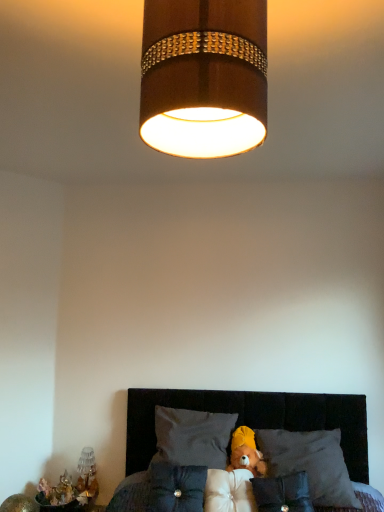
Question: Which direction should I rotate to look at dark gray fabric pillow at center, the fifth pillow positioned from the left?

Choices:
 (A) left
 (B) right

Answer: (B)

Question: Is gray fabric pillow at center, the second pillow in the left-to-right sequence, thinner than wooden lampshade at upper center?

Choices:
 (A) yes
 (B) no

Answer: (B)

Question: Is gray fabric pillow at center, the fourth pillow positioned from the right, taller than wooden lampshade at upper center?

Choices:
 (A) no
 (B) yes

Answer: (A)

Question: Does gray fabric pillow at center, the second pillow in the left-to-right sequence, lie in front of wooden lampshade at upper center?

Choices:
 (A) no
 (B) yes

Answer: (A)

Question: Is gray fabric pillow at center, the second pillow in the left-to-right sequence, at the left side of wooden lampshade at upper center?

Choices:
 (A) yes
 (B) no

Answer: (A)

Question: Considering the relative sizes of gray fabric pillow at center, the fourth pillow positioned from the right, and wooden lampshade at upper center in the image provided, is gray fabric pillow at center, the fourth pillow positioned from the right, smaller than wooden lampshade at upper center?

Choices:
 (A) no
 (B) yes

Answer: (A)

Question: Does gray fabric pillow at center, the fourth pillow positioned from the right, have a greater width compared to wooden lampshade at upper center?

Choices:
 (A) no
 (B) yes

Answer: (B)

Question: Considering the relative positions of wooden lampshade at upper center and translucent glass vase at lower left in the image provided, is wooden lampshade at upper center to the right of translucent glass vase at lower left from the viewer's perspective?

Choices:
 (A) no
 (B) yes

Answer: (B)

Question: Is translucent glass vase at lower left at the back of wooden lampshade at upper center?

Choices:
 (A) no
 (B) yes

Answer: (A)

Question: Can you confirm if wooden lampshade at upper center is positioned to the left of translucent glass vase at lower left?

Choices:
 (A) no
 (B) yes

Answer: (A)

Question: Can you confirm if wooden lampshade at upper center is bigger than translucent glass vase at lower left?

Choices:
 (A) no
 (B) yes

Answer: (B)

Question: Is wooden lampshade at upper center oriented towards translucent glass vase at lower left?

Choices:
 (A) no
 (B) yes

Answer: (A)

Question: Considering the relative sizes of wooden lampshade at upper center and translucent glass vase at lower left in the image provided, is wooden lampshade at upper center wider than translucent glass vase at lower left?

Choices:
 (A) yes
 (B) no

Answer: (A)

Question: Is velvety gray pillow at center, placed as the 1th pillow when sorted from left to right, outside of wooden lampshade at upper center?

Choices:
 (A) no
 (B) yes

Answer: (B)